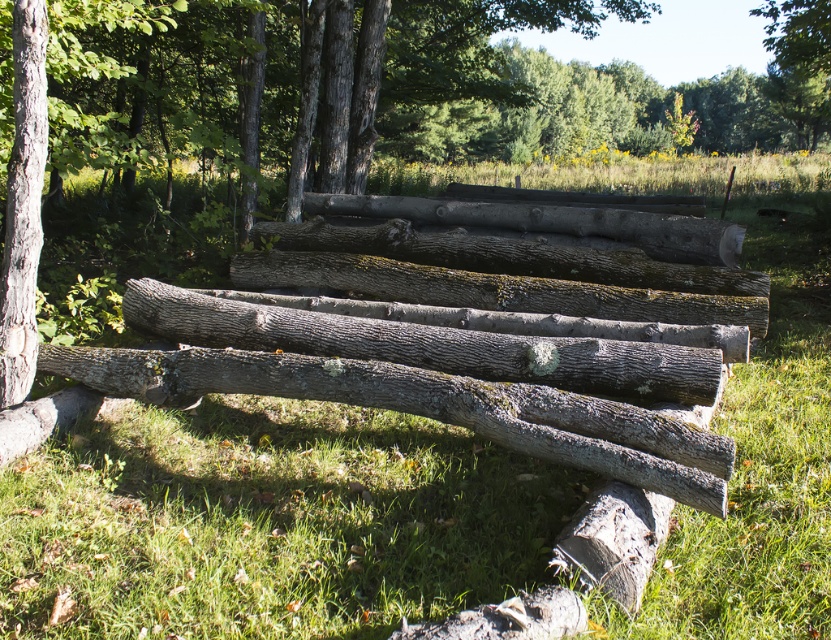
You are trying to stack the logs for a campfire. Which log should you place at the bottom to ensure stability? Consider the smooth bark logs at center and the gray rough wood log at center.

The smooth bark logs at center is taller than the gray rough wood log at center, so placing the taller log at the bottom would provide better stability for the stack.

You are a park ranger assessing the safety of a hiking trail. You notice two objects on the path ahead of you. The first is smooth bark logs at center, and the second is smooth brown tree trunk at left. Which object is taller?

The smooth bark logs at center has a greater height compared to the smooth brown tree trunk at left, so the smooth bark logs at center is taller.

You are a hiker trying to cross a stream using the logs shown in the scene. You need to place your left foot first. Which object should you step onto first, the smooth brown tree trunk at left or the gray rough wood log at center?

You should step onto the smooth brown tree trunk at left first because it is positioned to the left of the gray rough wood log at center, aligning with your left foot placement.